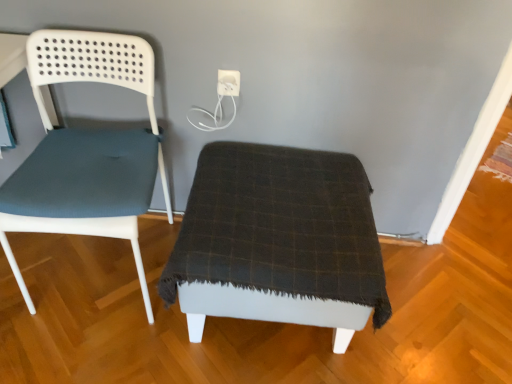
I want to click on free region under matte blue fabric chair at left (from a real-world perspective), so click(x=112, y=272).